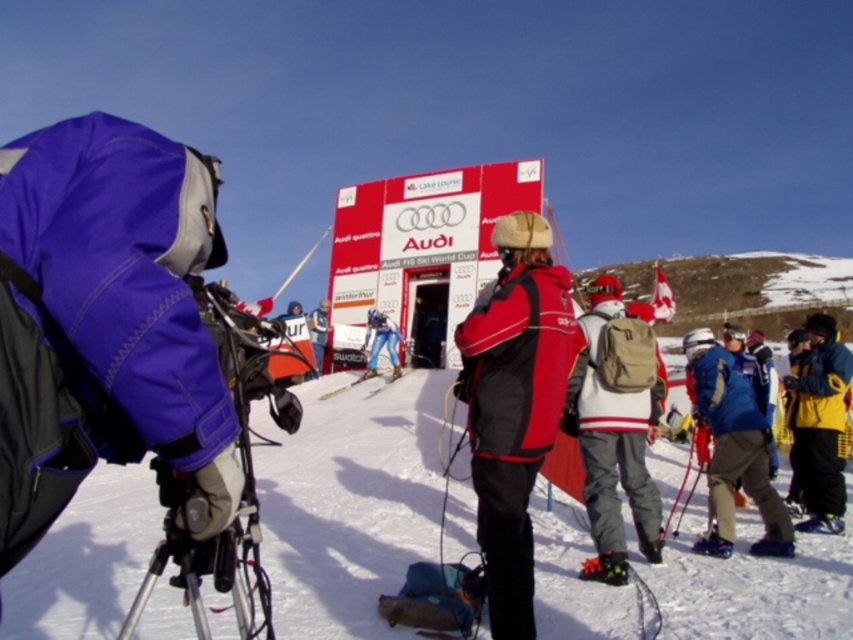
Can you confirm if yellow jacket at center is thinner than matte blue ski suit at center?

No, yellow jacket at center is not thinner than matte blue ski suit at center.

Can you confirm if yellow jacket at center is positioned above matte blue ski suit at center?

Actually, yellow jacket at center is below matte blue ski suit at center.

Is point (802, 461) more distant than point (370, 356)?

That is False.

The width and height of the screenshot is (853, 640). I want to click on yellow jacket at center, so click(x=819, y=422).

Image resolution: width=853 pixels, height=640 pixels. What are the coordinates of `beige fabric backpack at center` in the screenshot? It's located at (616, 428).

Between beige fabric backpack at center and white metallic ski at center, which one has more height?

Standing taller between the two is beige fabric backpack at center.

Which is behind, point (613, 400) or point (370, 374)?

The point (370, 374) is more distant.

The image size is (853, 640). Identify the location of beige fabric backpack at center. (616, 428).

Is red matte jacket at center positioned in front of yellow jacket at center?

That is True.

Can you confirm if red matte jacket at center is positioned to the right of yellow jacket at center?

In fact, red matte jacket at center is to the left of yellow jacket at center.

Locate an element on the screen. red matte jacket at center is located at coordinates (514, 404).

Where is `red matte jacket at center`? The height and width of the screenshot is (640, 853). red matte jacket at center is located at coordinates (514, 404).